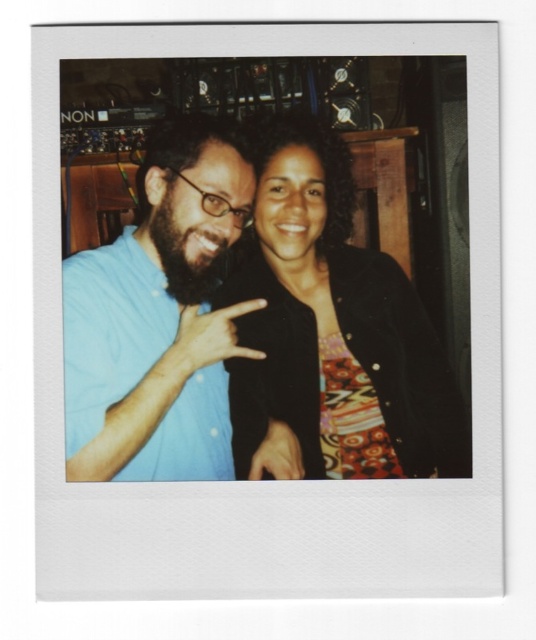
Question: Which object appears farthest from the camera in this image?

Choices:
 (A) black textured jacket at center
 (B) blue cotton shirt at center

Answer: (A)

Question: From the image, what is the correct spatial relationship of black textured jacket at center in relation to blue cotton shirt at center?

Choices:
 (A) below
 (B) above

Answer: (A)

Question: Does black textured jacket at center have a lesser width compared to blue cotton shirt at center?

Choices:
 (A) yes
 (B) no

Answer: (B)

Question: Among these objects, which one is nearest to the camera?

Choices:
 (A) blue cotton shirt at center
 (B) black textured jacket at center

Answer: (A)

Question: Can you confirm if black textured jacket at center is wider than blue cotton shirt at center?

Choices:
 (A) no
 (B) yes

Answer: (B)